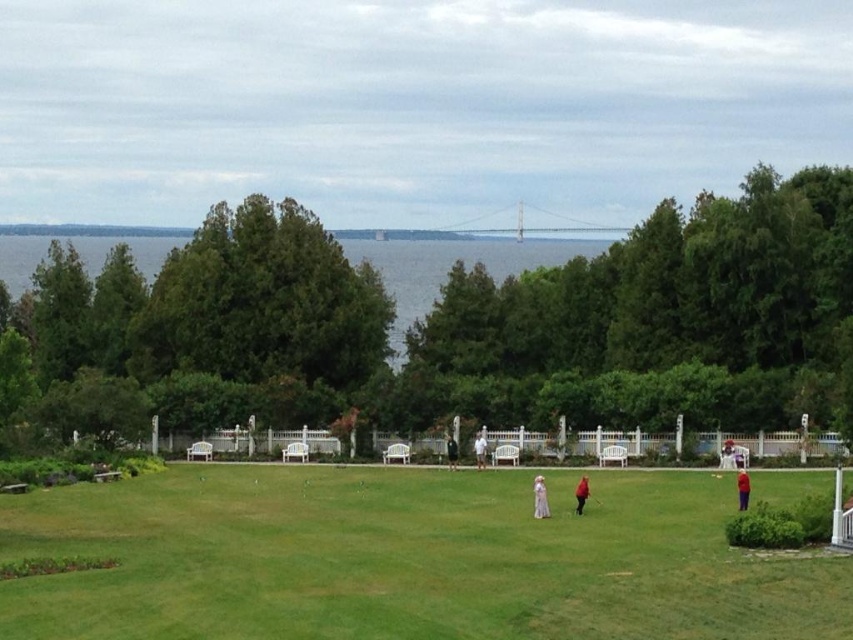
You are standing at the edge of the field and want to see the dark gray sweater at center clearly. Is the red velvet coat at lower right blocking your view of it?

The red velvet coat at lower right is in front of the dark gray sweater at center, so it is blocking your view of the dark gray sweater at center.

You are standing at the starting point of a game and see the red velvet coat at lower right. If you need to reach it within 10 seconds, what is the minimum speed you must maintain?

The red velvet coat at lower right is 43.31 meters away. To reach it in 10 seconds, you must maintain a minimum speed of 4.33 meters per second.